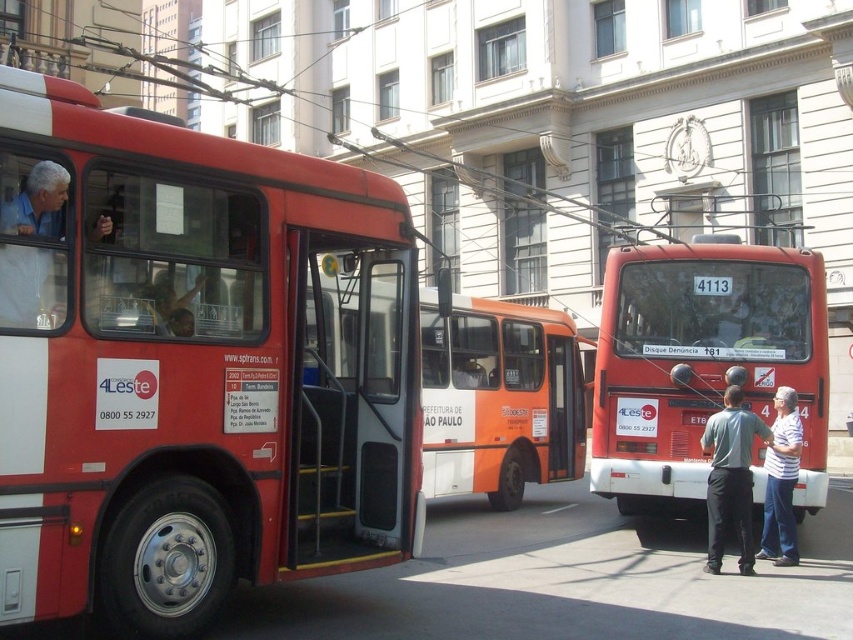
Question: Which object appears closest to the camera in this image?

Choices:
 (A) matte red bus at left
 (B) white striped shirt at lower right
 (C) matte red bus at center

Answer: (A)

Question: Which of the following is the farthest from the observer?

Choices:
 (A) (653, 392)
 (B) (775, 456)
 (C) (706, 570)
 (D) (392, 552)

Answer: (A)

Question: Can you confirm if gray hair man at left is bigger than white striped shirt at lower right?

Choices:
 (A) no
 (B) yes

Answer: (A)

Question: Can you confirm if matte red bus at left is positioned to the left of white striped shirt at lower right?

Choices:
 (A) yes
 (B) no

Answer: (A)

Question: In this image, where is matte red bus at left located relative to orange matte bus at center?

Choices:
 (A) above
 (B) below

Answer: (B)

Question: Which object is positioned farthest from the matte red bus at left?

Choices:
 (A) gray cotton shirt at center
 (B) white striped shirt at lower right
 (C) gray hair man at left

Answer: (B)